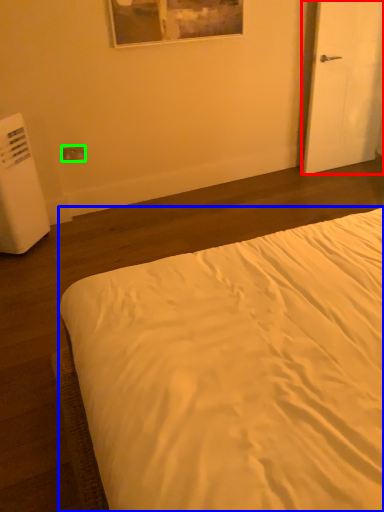
Question: Estimate the real-world distances between objects in this image. Which object is farther from door (highlighted by a red box), bed (highlighted by a blue box) or electric outlet (highlighted by a green box)?

Choices:
 (A) bed
 (B) electric outlet

Answer: (A)